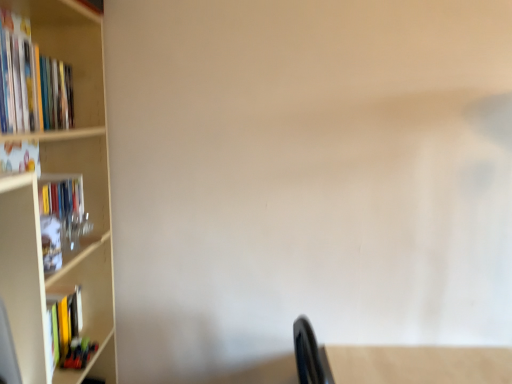
This screenshot has width=512, height=384. Identify the location of hardcover book at left, which is the second book from top to bottom. (61, 217).

What do you see at coordinates (79, 353) in the screenshot? Image resolution: width=512 pixels, height=384 pixels. I see `matte green book at lower left, the first book when ordered from bottom to top` at bounding box center [79, 353].

This screenshot has height=384, width=512. What do you see at coordinates (85, 197) in the screenshot?
I see `white matte bookcase at left` at bounding box center [85, 197].

The image size is (512, 384). I want to click on hardcover books at left, which is counted as the third book, starting from the bottom, so click(31, 82).

Locate an element on the screen. hardcover book at left, which is the second book from top to bottom is located at coordinates (61, 217).

Is hardcover books at left, which is counted as the third book, starting from the bottom, bigger or smaller than hardcover book at left, which is the second book from top to bottom?

Clearly, hardcover books at left, which is counted as the third book, starting from the bottom, is larger in size than hardcover book at left, which is the second book from top to bottom.

At what (x,y) coordinates should I click in order to perform the action: click on book located on the left of hardcover books at left, which ranks as the 1th book in top-to-bottom order. Please return your answer as a coordinate pair (x, y). Looking at the image, I should click on (61, 217).

Is point (44, 67) closer to viewer compared to point (83, 207)?

Yes, point (44, 67) is closer to viewer.

Can you confirm if hardcover books at left, which is counted as the third book, starting from the bottom, is shorter than hardcover book at left, which is the second book from top to bottom?

In fact, hardcover books at left, which is counted as the third book, starting from the bottom, may be taller than hardcover book at left, which is the second book from top to bottom.

Looking at this image, from the image's perspective, is white matte bookcase at left beneath matte green book at lower left, the first book when ordered from bottom to top?

Incorrect, from the image's perspective, white matte bookcase at left is higher than matte green book at lower left, the first book when ordered from bottom to top.

From a real-world perspective, is white matte bookcase at left under matte green book at lower left, arranged as the third book when viewed from the top?

No, from a real-world perspective, white matte bookcase at left is not below matte green book at lower left, arranged as the third book when viewed from the top.

Is white matte bookcase at left inside the boundaries of matte green book at lower left, arranged as the third book when viewed from the top, or outside?

white matte bookcase at left cannot be found inside matte green book at lower left, arranged as the third book when viewed from the top.

Who is more distant, white matte bookcase at left or matte green book at lower left, arranged as the third book when viewed from the top?

matte green book at lower left, arranged as the third book when viewed from the top, is behind.

From a real-world perspective, is white matte bookcase at left positioned above or below hardcover book at left, which is the second book from bottom to top?

white matte bookcase at left is situated lower than hardcover book at left, which is the second book from bottom to top, in the real world.

Which of these two, white matte bookcase at left or hardcover book at left, which is the second book from top to bottom, is thinner?

Thinner between the two is hardcover book at left, which is the second book from top to bottom.

Which of these two, white matte bookcase at left or hardcover book at left, which is the second book from bottom to top, is smaller?

hardcover book at left, which is the second book from bottom to top, is smaller.

In terms of height, does white matte bookcase at left look taller or shorter compared to hardcover book at left, which is the second book from bottom to top?

Considering their sizes, white matte bookcase at left has more height than hardcover book at left, which is the second book from bottom to top.

From a real-world perspective, which object rests below the other?

white matte bookcase at left, from a real-world perspective.

How many degrees apart are the facing directions of white matte bookcase at left and hardcover books at left, which is counted as the third book, starting from the bottom?

2.45 degrees.

Is white matte bookcase at left aimed at hardcover books at left, which is counted as the third book, starting from the bottom?

Yes, white matte bookcase at left is aimed at hardcover books at left, which is counted as the third book, starting from the bottom.

Where is `bookcase in front of the hardcover books at left, which is counted as the third book, starting from the bottom`? The width and height of the screenshot is (512, 384). bookcase in front of the hardcover books at left, which is counted as the third book, starting from the bottom is located at coordinates (85, 197).

Looking at the image, does hardcover books at left, which is counted as the third book, starting from the bottom, seem bigger or smaller compared to matte green book at lower left, the first book when ordered from bottom to top?

hardcover books at left, which is counted as the third book, starting from the bottom, is bigger than matte green book at lower left, the first book when ordered from bottom to top.

What's the angular difference between hardcover books at left, which is counted as the third book, starting from the bottom, and matte green book at lower left, the first book when ordered from bottom to top,'s facing directions?

The angular difference between hardcover books at left, which is counted as the third book, starting from the bottom, and matte green book at lower left, the first book when ordered from bottom to top, is 1.81 degrees.

Considering the sizes of hardcover books at left, which is counted as the third book, starting from the bottom, and matte green book at lower left, arranged as the third book when viewed from the top, in the image, is hardcover books at left, which is counted as the third book, starting from the bottom, wider or thinner than matte green book at lower left, arranged as the third book when viewed from the top,?

In the image, hardcover books at left, which is counted as the third book, starting from the bottom, appears to be wider than matte green book at lower left, arranged as the third book when viewed from the top.

From a real-world perspective, is hardcover book at left, which is the second book from top to bottom, positioned under hardcover books at left, which ranks as the 1th book in top-to-bottom order, based on gravity?

Yes, from a real-world perspective, hardcover book at left, which is the second book from top to bottom, is beneath hardcover books at left, which ranks as the 1th book in top-to-bottom order.

How many degrees apart are the facing directions of hardcover book at left, which is the second book from bottom to top, and hardcover books at left, which ranks as the 1th book in top-to-bottom order?

The facing directions of hardcover book at left, which is the second book from bottom to top, and hardcover books at left, which ranks as the 1th book in top-to-bottom order, are 0.859 degrees apart.

Would you say hardcover book at left, which is the second book from top to bottom, is outside hardcover books at left, which ranks as the 1th book in top-to-bottom order?

Yes, hardcover book at left, which is the second book from top to bottom, is outside of hardcover books at left, which ranks as the 1th book in top-to-bottom order.

Considering the relative sizes of hardcover book at left, which is the second book from bottom to top, and hardcover books at left, which ranks as the 1th book in top-to-bottom order, in the image provided, is hardcover book at left, which is the second book from bottom to top, smaller than hardcover books at left, which ranks as the 1th book in top-to-bottom order,?

Yes, hardcover book at left, which is the second book from bottom to top, is smaller than hardcover books at left, which ranks as the 1th book in top-to-bottom order.

Considering the relative positions of hardcover books at left, which ranks as the 1th book in top-to-bottom order, and white matte bookcase at left in the image provided, is hardcover books at left, which ranks as the 1th book in top-to-bottom order, to the left of white matte bookcase at left from the viewer's perspective?

No.

How distant is hardcover books at left, which is counted as the third book, starting from the bottom, from white matte bookcase at left?

hardcover books at left, which is counted as the third book, starting from the bottom, is 17.66 centimeters away from white matte bookcase at left.

Is white matte bookcase at left at the back of hardcover books at left, which ranks as the 1th book in top-to-bottom order?

Yes, hardcover books at left, which ranks as the 1th book in top-to-bottom order, is positioned with its back facing white matte bookcase at left.

Identify the location of bookcase on the left side of hardcover books at left, which ranks as the 1th book in top-to-bottom order. The height and width of the screenshot is (384, 512). (85, 197).

The image size is (512, 384). What are the coordinates of `book on the left of hardcover books at left, which is counted as the third book, starting from the bottom` in the screenshot? It's located at (61, 217).

Where is `bookcase that is above the matte green book at lower left, the first book when ordered from bottom to top (from a real-world perspective)`? The image size is (512, 384). bookcase that is above the matte green book at lower left, the first book when ordered from bottom to top (from a real-world perspective) is located at coordinates (85, 197).

Considering their positions, is matte green book at lower left, arranged as the third book when viewed from the top, positioned closer to hardcover books at left, which ranks as the 1th book in top-to-bottom order, than white matte bookcase at left?

white matte bookcase at left is positioned closer to the anchor hardcover books at left, which ranks as the 1th book in top-to-bottom order.

From the image, which object appears to be nearer to hardcover book at left, which is the second book from bottom to top, white matte bookcase at left or hardcover books at left, which ranks as the 1th book in top-to-bottom order?

white matte bookcase at left is closer to hardcover book at left, which is the second book from bottom to top.

Looking at the image, which one is located closer to white matte bookcase at left, matte green book at lower left, arranged as the third book when viewed from the top, or hardcover books at left, which is counted as the third book, starting from the bottom?

The object closer to white matte bookcase at left is hardcover books at left, which is counted as the third book, starting from the bottom.

Looking at the image, which one is located closer to white matte bookcase at left, hardcover books at left, which is counted as the third book, starting from the bottom, or hardcover book at left, which is the second book from bottom to top?

Among the two, hardcover books at left, which is counted as the third book, starting from the bottom, is located nearer to white matte bookcase at left.

Which object lies nearer to the anchor point white matte bookcase at left, hardcover book at left, which is the second book from bottom to top, or hardcover books at left, which is counted as the third book, starting from the bottom?

The object closer to white matte bookcase at left is hardcover books at left, which is counted as the third book, starting from the bottom.

Estimate the real-world distances between objects in this image. Which object is further from matte green book at lower left, the first book when ordered from bottom to top, hardcover book at left, which is the second book from top to bottom, or white matte bookcase at left?

hardcover book at left, which is the second book from top to bottom, is positioned further to the anchor matte green book at lower left, the first book when ordered from bottom to top.

Looking at the image, which one is located closer to hardcover book at left, which is the second book from bottom to top, hardcover books at left, which ranks as the 1th book in top-to-bottom order, or matte green book at lower left, arranged as the third book when viewed from the top?

hardcover books at left, which ranks as the 1th book in top-to-bottom order, lies closer to hardcover book at left, which is the second book from bottom to top, than the other object.

From the image, which object appears to be nearer to hardcover books at left, which is counted as the third book, starting from the bottom, matte green book at lower left, arranged as the third book when viewed from the top, or hardcover book at left, which is the second book from bottom to top?

hardcover book at left, which is the second book from bottom to top.

Where is `bookcase between hardcover books at left, which is counted as the third book, starting from the bottom, and matte green book at lower left, arranged as the third book when viewed from the top, from top to bottom`? This screenshot has width=512, height=384. bookcase between hardcover books at left, which is counted as the third book, starting from the bottom, and matte green book at lower left, arranged as the third book when viewed from the top, from top to bottom is located at coordinates (85, 197).

This screenshot has height=384, width=512. I want to click on book between hardcover books at left, which is counted as the third book, starting from the bottom, and white matte bookcase at left from top to bottom, so click(x=61, y=217).

Find the location of a particular element. book that lies between hardcover books at left, which is counted as the third book, starting from the bottom, and matte green book at lower left, arranged as the third book when viewed from the top, from top to bottom is located at coordinates (61, 217).